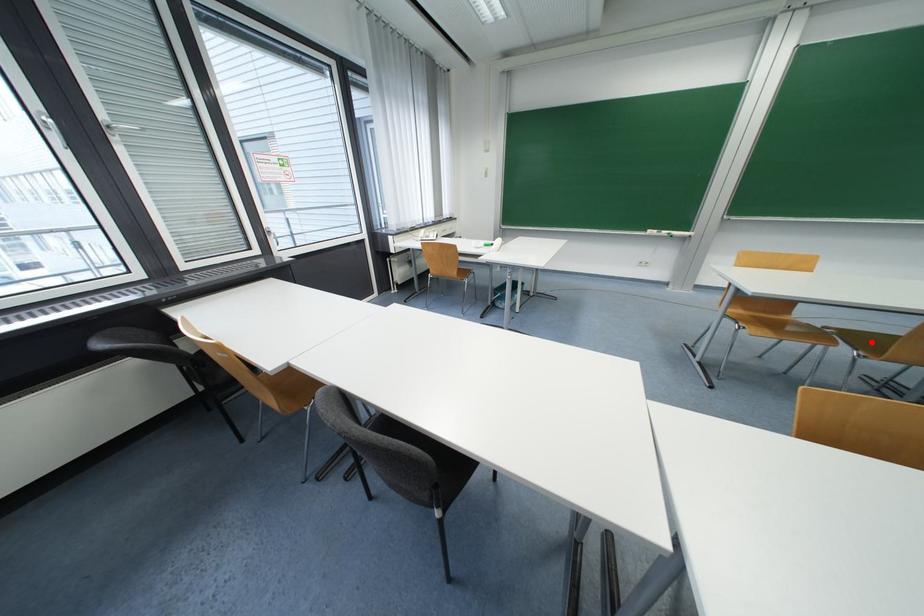
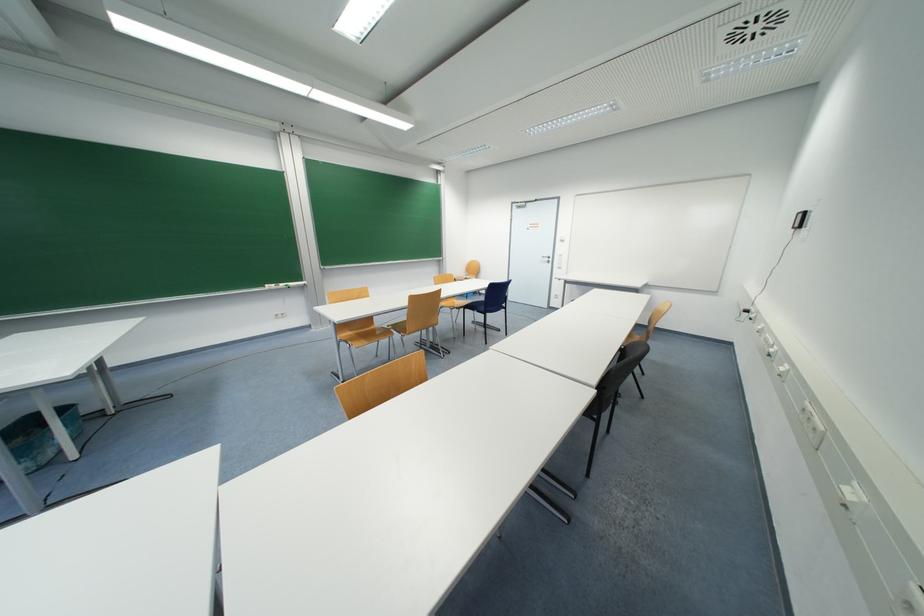
Question: I am providing you with two images of the same scene from different viewpoints. A red point is shown in image1. For the corresponding object point in image2, is it positioned nearer or farther from the camera?

Choices:
 (A) Nearer
 (B) Farther

Answer: (A)